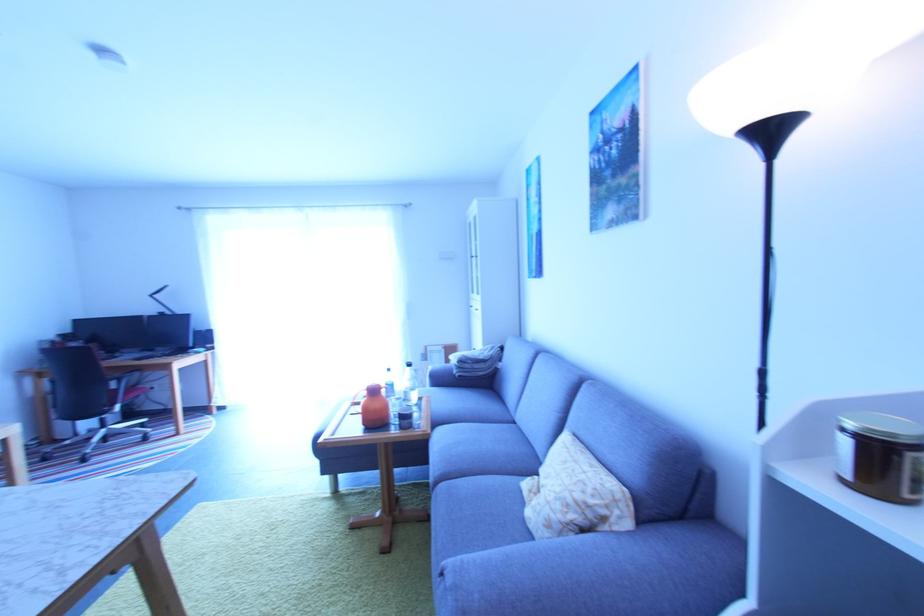
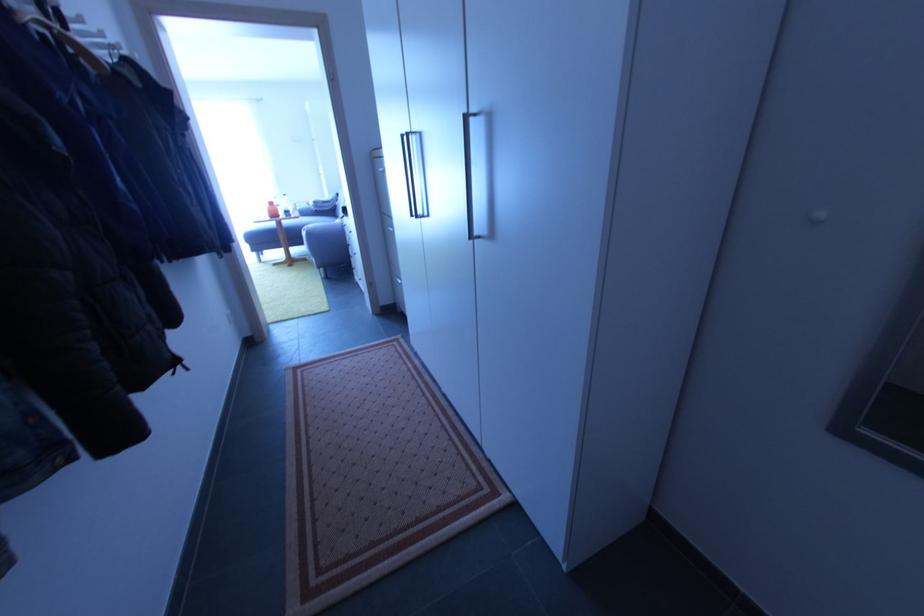
Question: I am providing you with two images of the same scene from different viewpoints. Which of the following objects are not visible in image2?

Choices:
 (A) orange bottle
 (B) sofa sitting surface
 (C) sofa armrest
 (D) none of these

Answer: (D)